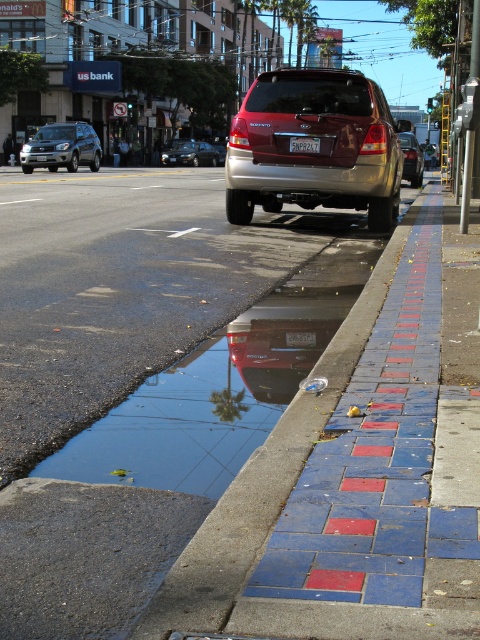
Question: Is blue brick sidewalk at lower right closer to the viewer compared to black plastic license plate at center?

Choices:
 (A) yes
 (B) no

Answer: (A)

Question: Which point is closer to the camera taking this photo?

Choices:
 (A) (285, 324)
 (B) (311, 344)

Answer: (B)

Question: Which is farther from the blue brick sidewalk at lower right?

Choices:
 (A) metallic silver sedan at center
 (B) transparent glass puddle at lower left
 (C) metallic silver suv at center

Answer: (A)

Question: Can you confirm if transparent glass puddle at lower left is smaller than maroon metallic suv at center?

Choices:
 (A) no
 (B) yes

Answer: (B)

Question: Is the position of maroon metallic suv at center less distant than that of white plastic license plate at center?

Choices:
 (A) yes
 (B) no

Answer: (A)

Question: Which object is positioned closest to the white plastic license plate at center?

Choices:
 (A) maroon metallic suv at center
 (B) metallic silver suv at center
 (C) blue brick sidewalk at lower right

Answer: (A)